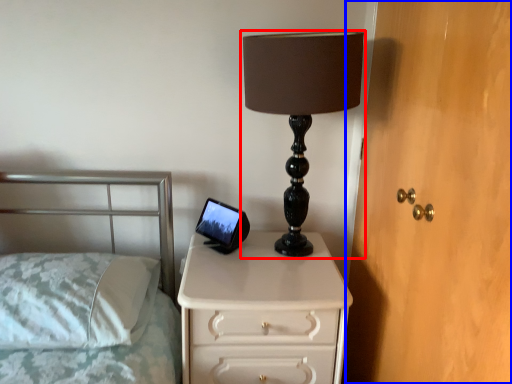
Question: Which point is further to the camera, lamp (highlighted by a red box) or dresser (highlighted by a blue box)?

Choices:
 (A) lamp
 (B) dresser

Answer: (A)